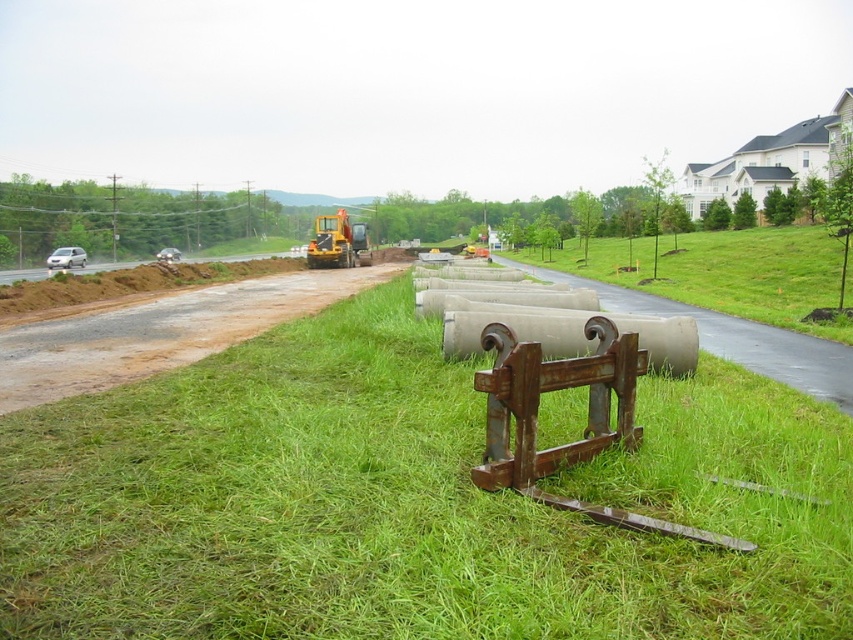
Question: Is brown dirt track at left below yellow rubber excavator at center?

Choices:
 (A) yes
 (B) no

Answer: (A)

Question: Which point appears farthest from the camera in this image?

Choices:
 (A) (338, 209)
 (B) (274, 436)
 (C) (131, 355)

Answer: (A)

Question: Is brown dirt track at left to the right of yellow rubber excavator at center from the viewer's perspective?

Choices:
 (A) yes
 (B) no

Answer: (A)

Question: Among these objects, which one is nearest to the camera?

Choices:
 (A) yellow rubber excavator at center
 (B) brown dirt track at left
 (C) green grass at center

Answer: (B)

Question: Which object is the closest to the green grass at center?

Choices:
 (A) yellow rubber excavator at center
 (B) brown dirt track at left

Answer: (B)

Question: Is green grass at center below yellow rubber excavator at center?

Choices:
 (A) yes
 (B) no

Answer: (A)